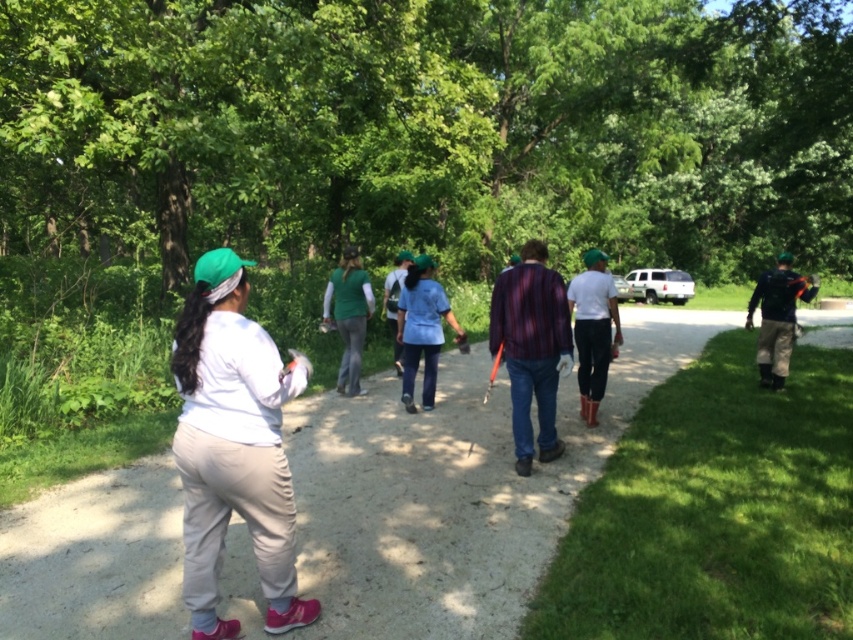
Based on the photo, is white fabric at center closer to the viewer compared to dark blue jacket at right?

Yes, white fabric at center is closer to the viewer.

Is point (71, 520) farther from viewer compared to point (750, 301)?

No, it is not.

Locate an element on the screen. white fabric at center is located at coordinates (453, 490).

Does green leafy tree at upper center appear over white matte shirt at center?

Yes.

The image size is (853, 640). Find the location of `green leafy tree at upper center`. green leafy tree at upper center is located at coordinates (426, 129).

Find the location of a particular element. The image size is (853, 640). green leafy tree at upper center is located at coordinates (426, 129).

Can you confirm if white fabric at center is taller than rubber boots at center?

In fact, white fabric at center may be shorter than rubber boots at center.

Between point (563, 435) and point (587, 396), which one is positioned in front?

Point (563, 435)

Does point (653, 372) come in front of point (589, 326)?

No, it is not.

Where is `white fabric at center`? The height and width of the screenshot is (640, 853). white fabric at center is located at coordinates (453, 490).